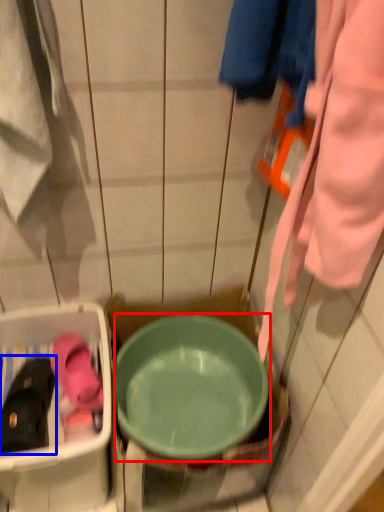
Question: Which object is further to the camera taking this photo, basin (highlighted by a red box) or footwear (highlighted by a blue box)?

Choices:
 (A) basin
 (B) footwear

Answer: (B)